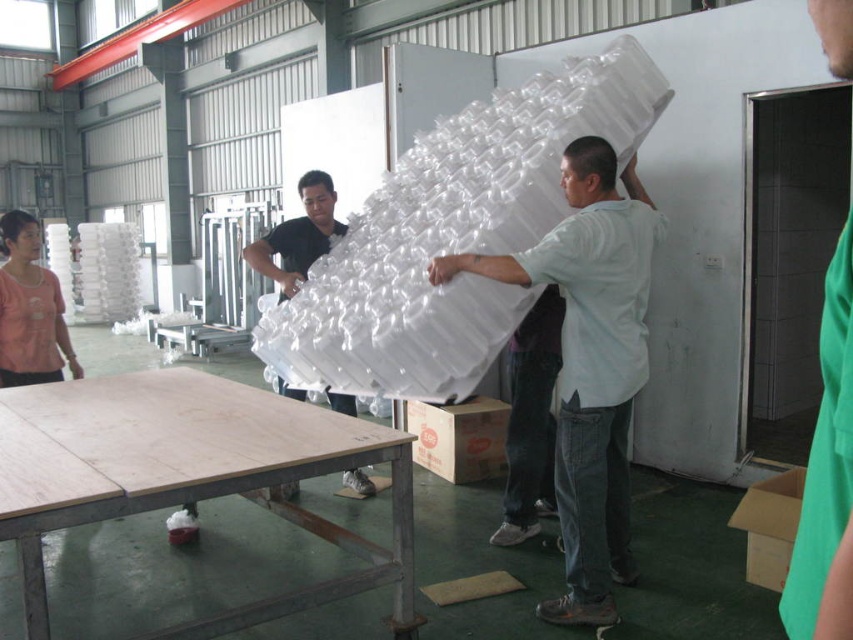
Where is the white matte foam at center located in the image?

The white matte foam at center is located at point (x=299, y=236) in the image.

Based on the scene description, where is the white matte bubble wrap at center located in the image?

The white matte bubble wrap at center is located at point coordinates of (589, 365).

You are a worker in the warehouse and need to place the white matte bubble wrap at center and the brown cardboard box at center onto a shelf. The shelf has limited height. Which object should you place first to ensure both fit on the shelf?

The white matte bubble wrap at center is located above the brown cardboard box at center, so you should place the brown cardboard box at center first on the shelf to accommodate the stacking order.